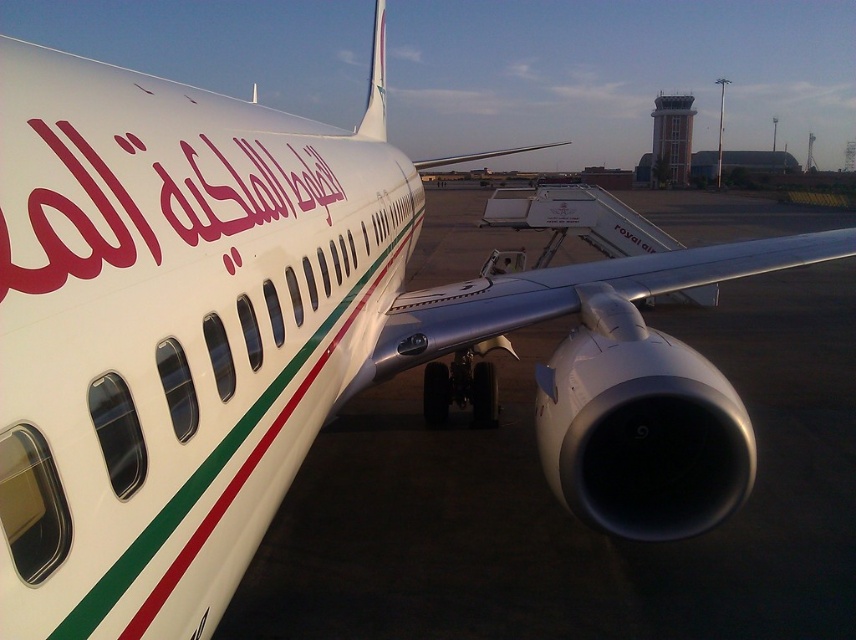
You are a photographer standing at the airport gate taking pictures of the airplane. You notice the matte red text at center and the white glossy tail at upper center. Which object is positioned closer to your camera lens?

The matte red text at center is closer to the viewer than the white glossy tail at upper center, so the matte red text at center is positioned closer to your camera lens.

You are standing at the airport gate looking at the airplane. Where is the point located at coordinates point [75,220]?

The point [75,220] corresponds to the matte red text at center.